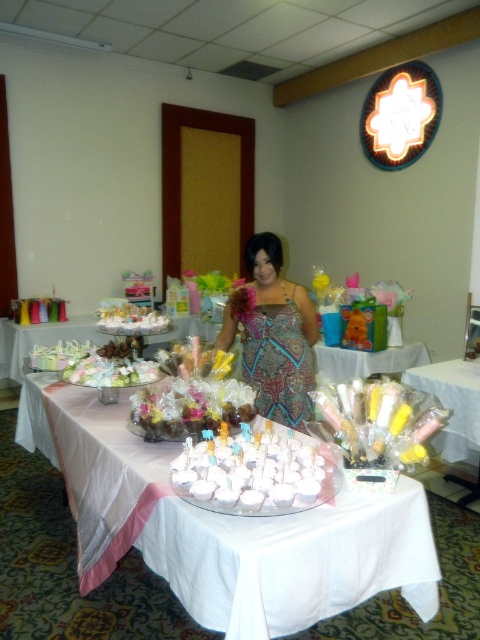
Question: Is white glossy flowers at center closer to the viewer compared to matte white cake at center?

Choices:
 (A) yes
 (B) no

Answer: (A)

Question: Which object is the closest to the shiny chocolate cake at center?

Choices:
 (A) white paper cupcake at center
 (B) matte white cake at center
 (C) matte plastic gift bags at center
 (D) white glossy cupcakes at center

Answer: (D)

Question: Is shiny chocolate cake at center below white glossy flowers at center?

Choices:
 (A) no
 (B) yes

Answer: (B)

Question: Estimate the real-world distances between objects in this image. Which object is farther from the paisley-patterned dress at center?

Choices:
 (A) white glossy cupcakes at center
 (B) white paper cupcake at center
 (C) matte white cake at center

Answer: (A)

Question: Which point is closer to the camera taking this photo?

Choices:
 (A) (264, 381)
 (B) (259, 472)
 (C) (349, 451)
 (D) (407, 518)

Answer: (B)

Question: In this image, where is matte white frosting at center located relative to matte white cake at center?

Choices:
 (A) left
 (B) right

Answer: (B)